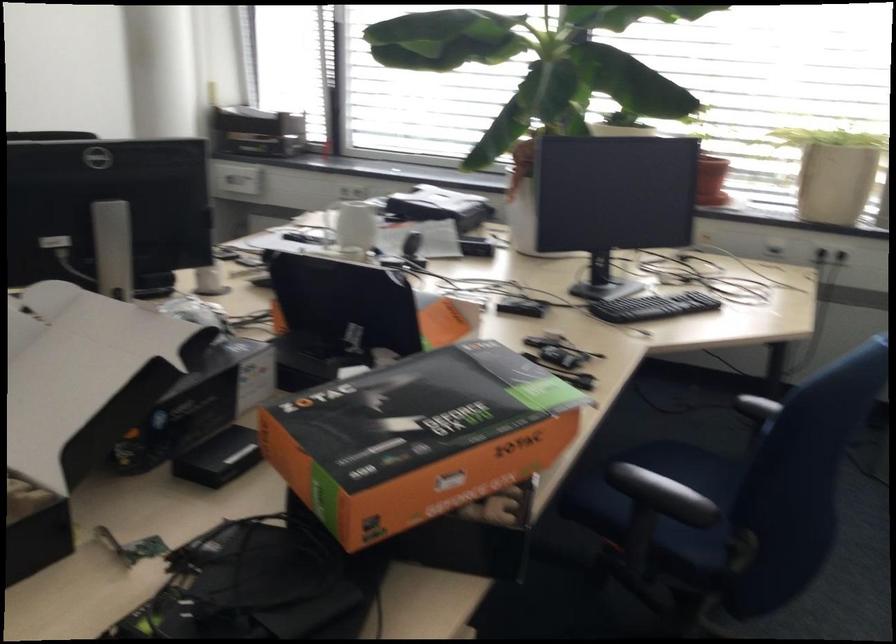
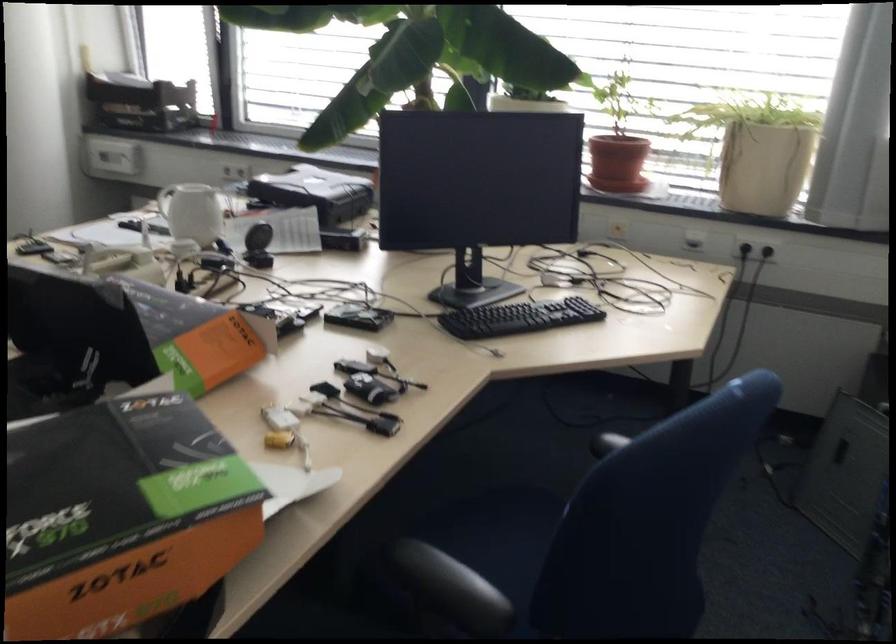
Find the pixel in the second image that matches the point at 502,406 in the first image.

(121, 516)